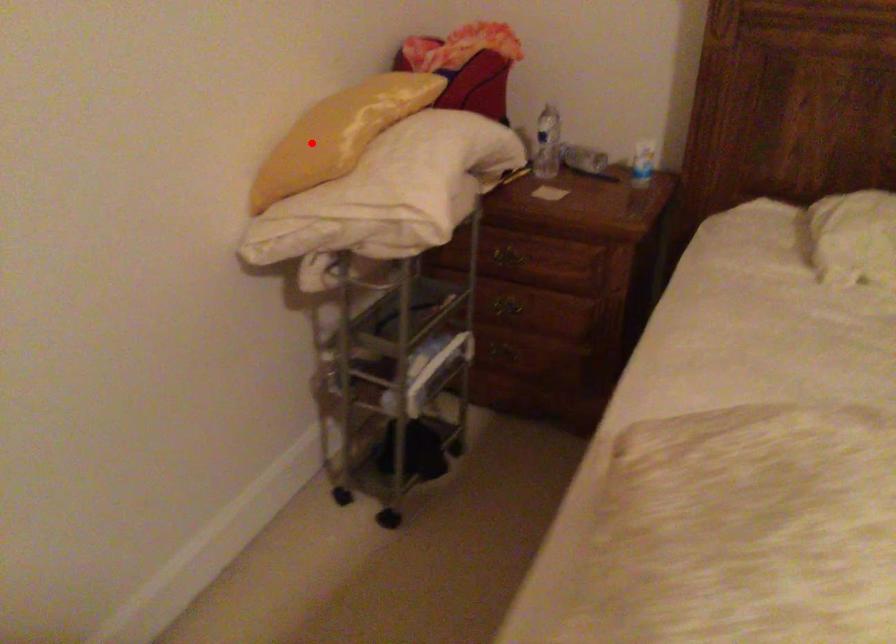
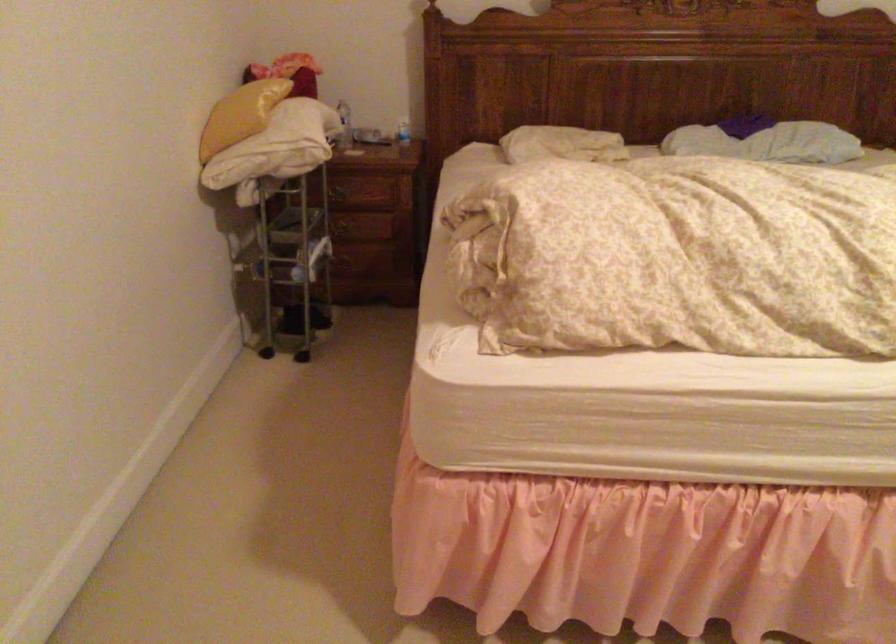
Question: I am providing you with two images of the same scene from different viewpoints. In image1, a red point is highlighted. Considering the same 3D point in image2, which of the following is correct?

Choices:
 (A) It is closer
 (B) It is farther

Answer: (B)